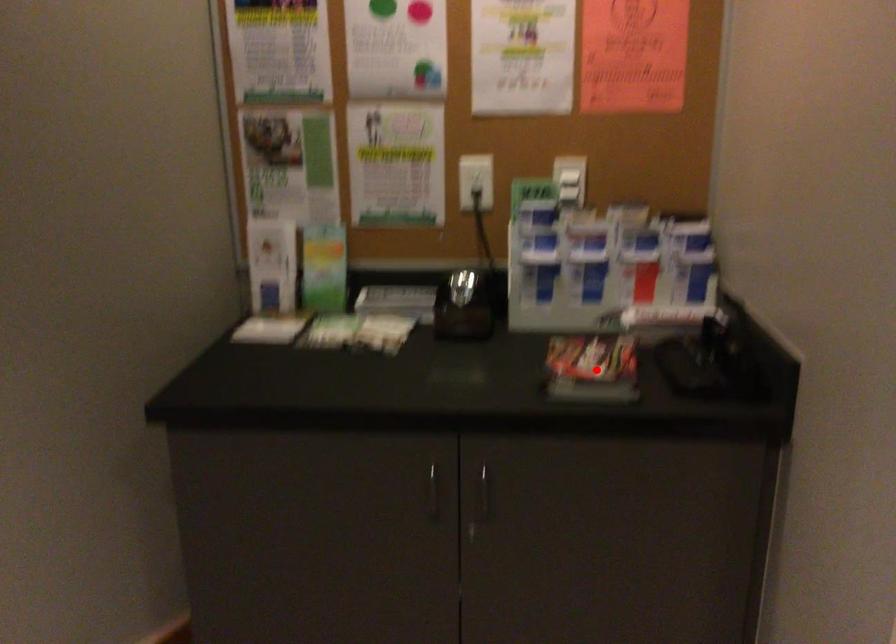
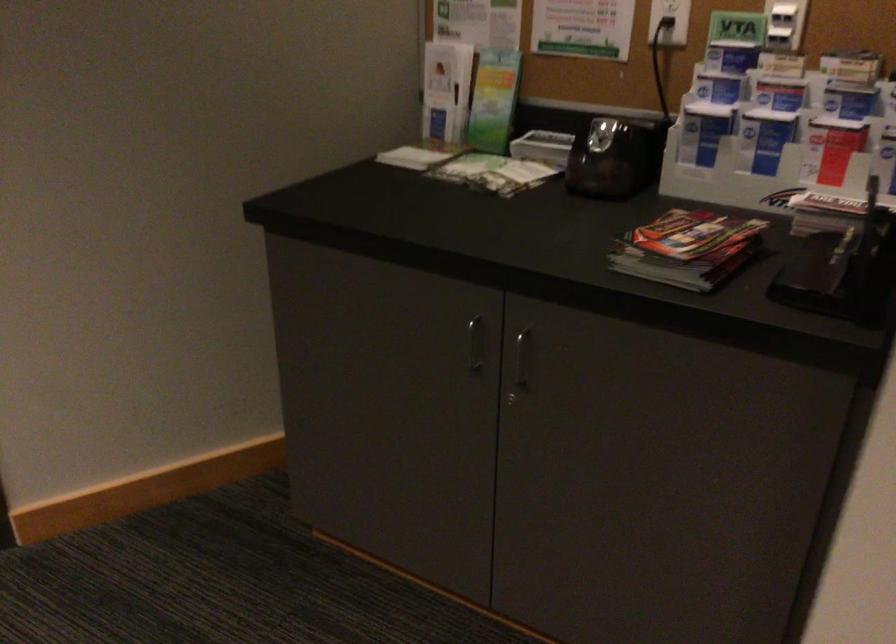
Question: I am providing you with two images of the same scene from different viewpoints. In image1, a red point is highlighted. Considering the same 3D point in image2, which of the following is correct?

Choices:
 (A) It is closer
 (B) It is farther

Answer: (A)